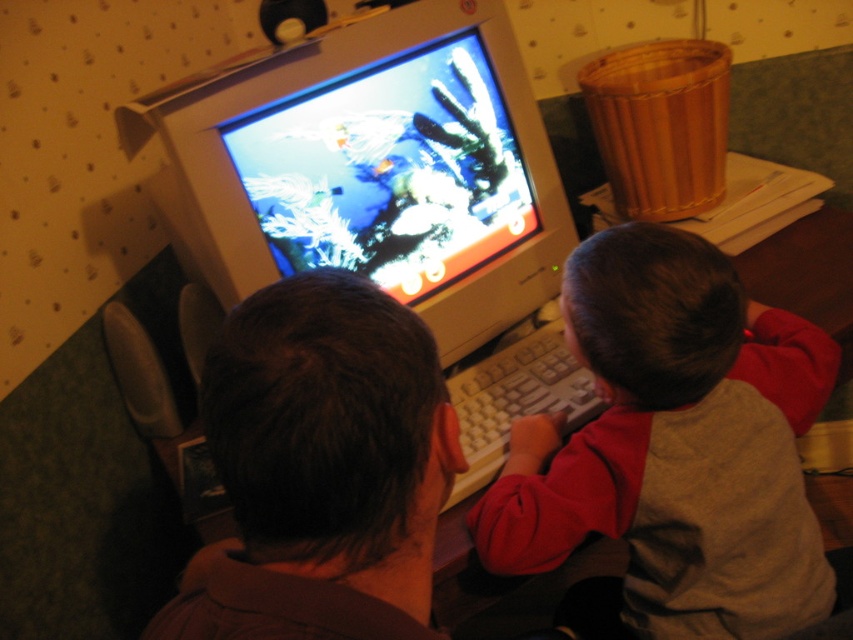
Looking at this image, you are trying to determine if the shiny plastic monitor at center can fit into a box that is the same width as the gray cotton shirt at center. Based on the scene, will it fit?

The shiny plastic monitor at center is wider than the gray cotton shirt at center, so it will not fit into a box that has the same width as the gray cotton shirt at center.